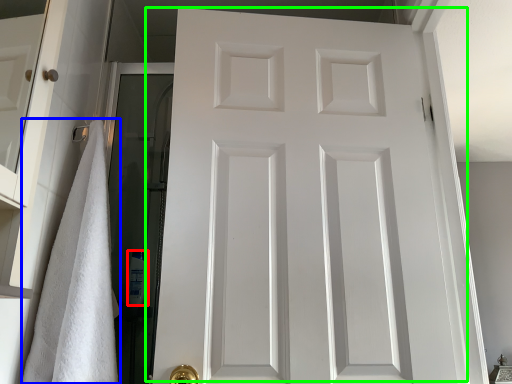
Question: Considering the real-world distances, which object is closest to toiletry (highlighted by a red box)? bath towel (highlighted by a blue box) or door (highlighted by a green box).

Choices:
 (A) bath towel
 (B) door

Answer: (A)